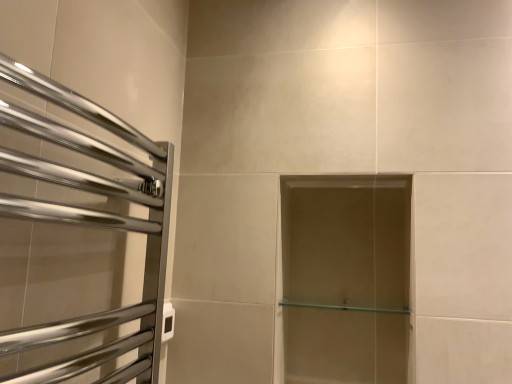
Question: In terms of width, does clear glass shelf at center look wider or thinner when compared to polished chrome towel rack at left?

Choices:
 (A) thin
 (B) wide

Answer: (B)

Question: Is point (367, 311) closer or farther from the camera than point (160, 276)?

Choices:
 (A) farther
 (B) closer

Answer: (A)

Question: From a real-world perspective, relative to polished chrome towel rack at left, is clear glass shelf at center vertically above or below?

Choices:
 (A) above
 (B) below

Answer: (B)

Question: In terms of size, does polished chrome towel rack at left appear bigger or smaller than clear glass shelf at center?

Choices:
 (A) small
 (B) big

Answer: (B)

Question: Is polished chrome towel rack at left inside or outside of clear glass shelf at center?

Choices:
 (A) outside
 (B) inside

Answer: (A)

Question: Would you say polished chrome towel rack at left is to the left or to the right of clear glass shelf at center in the picture?

Choices:
 (A) right
 (B) left

Answer: (B)

Question: From a real-world perspective, is polished chrome towel rack at left above or below clear glass shelf at center?

Choices:
 (A) above
 (B) below

Answer: (A)